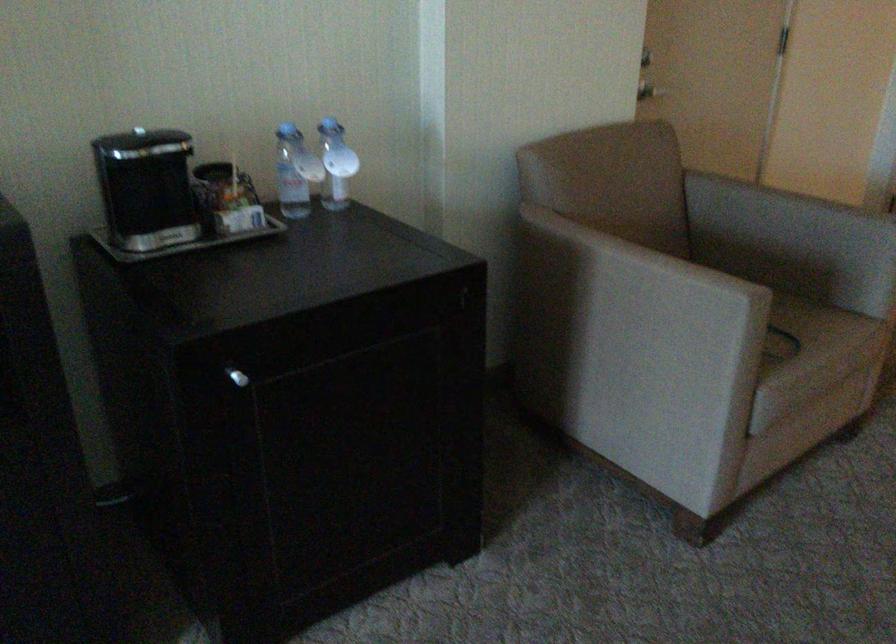
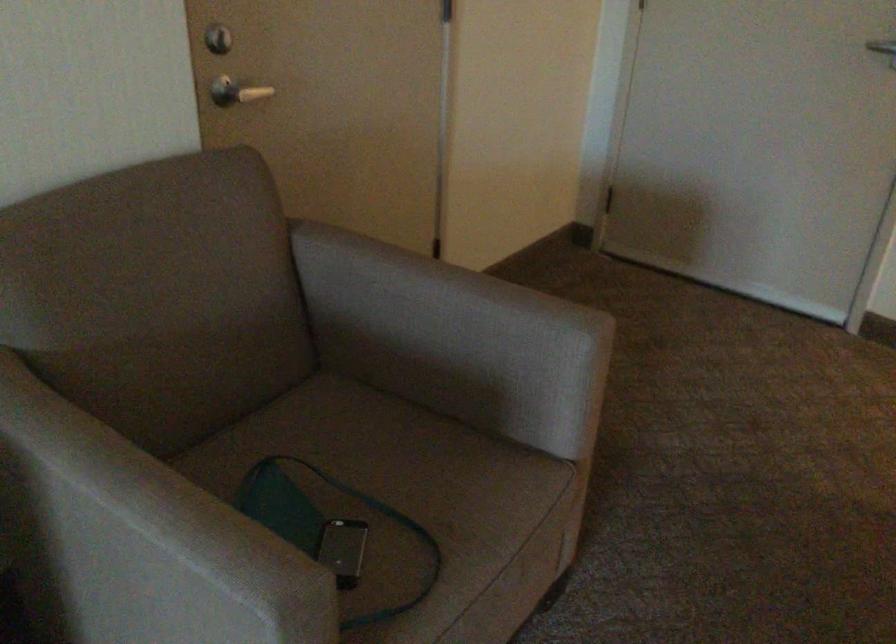
Where in the second image is the point corresponding to point 778,317 from the first image?

(412, 505)